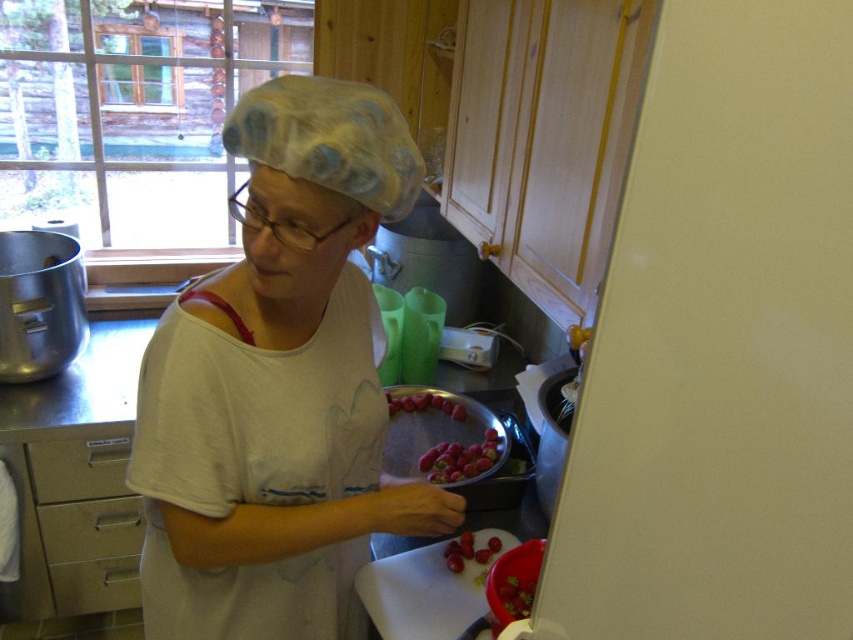
Question: Does metallic silver drawer at lower left have a larger size compared to smooth red strawberries at lower center?

Choices:
 (A) no
 (B) yes

Answer: (B)

Question: Among these points, which one is nearest to the camera?

Choices:
 (A) (434, 458)
 (B) (491, 540)
 (C) (103, 499)
 (D) (103, 449)

Answer: (B)

Question: Does white matte hairnet at upper center have a larger size compared to metallic silver drawer at lower left?

Choices:
 (A) yes
 (B) no

Answer: (A)

Question: Estimate the real-world distances between objects in this image. Which object is farther from the smooth red strawberries at lower center?

Choices:
 (A) metallic silver drawer at lower left
 (B) white matte hairnet at upper center

Answer: (A)

Question: Which point appears closest to the camera in this image?

Choices:
 (A) (138, 504)
 (B) (456, 449)
 (C) (491, 538)
 (D) (289, 124)

Answer: (D)

Question: Does ripe red grapes at center appear over shiny red strawberries at center?

Choices:
 (A) yes
 (B) no

Answer: (B)